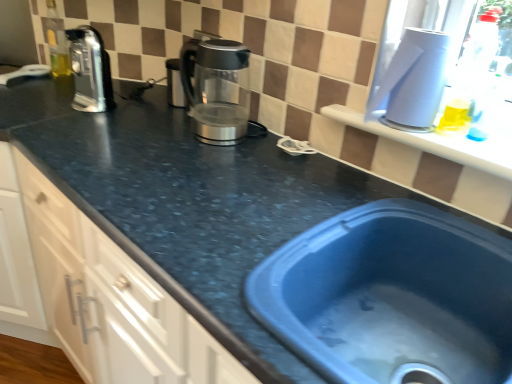
Question: From a real-world perspective, is satin silver kettle at center, which appears as the second appliance when viewed from the front, over matte black countertop at left?

Choices:
 (A) yes
 (B) no

Answer: (A)

Question: Can you confirm if satin silver kettle at center, the 2th appliance viewed from the right, is thinner than matte black countertop at left?

Choices:
 (A) yes
 (B) no

Answer: (A)

Question: From the image's perspective, is satin silver kettle at center, the 2th appliance viewed from the right, on matte black countertop at left?

Choices:
 (A) yes
 (B) no

Answer: (A)

Question: Can you confirm if satin silver kettle at center, placed as the 1th appliance when sorted from back to front, is wider than matte black countertop at left?

Choices:
 (A) no
 (B) yes

Answer: (A)

Question: Is satin silver kettle at center, which appears as the second appliance when viewed from the front, taller than matte black countertop at left?

Choices:
 (A) yes
 (B) no

Answer: (B)

Question: Considering the positions of satin silver coffee pot at upper left and matte black countertop at left in the image, is satin silver coffee pot at upper left wider or thinner than matte black countertop at left?

Choices:
 (A) wide
 (B) thin

Answer: (B)

Question: From a real-world perspective, is satin silver coffee pot at upper left physically located above or below matte black countertop at left?

Choices:
 (A) below
 (B) above

Answer: (B)

Question: Looking at the image, does satin silver coffee pot at upper left seem bigger or smaller compared to matte black countertop at left?

Choices:
 (A) small
 (B) big

Answer: (A)

Question: Is point (78, 82) closer or farther from the camera than point (90, 337)?

Choices:
 (A) farther
 (B) closer

Answer: (A)

Question: From their relative heights in the image, would you say satin silver kettle at center, the 2th appliance viewed from the right, is taller or shorter than blue plastic sink at lower right?

Choices:
 (A) tall
 (B) short

Answer: (B)

Question: In terms of width, does satin silver kettle at center, the 2th appliance viewed from the right, look wider or thinner when compared to blue plastic sink at lower right?

Choices:
 (A) thin
 (B) wide

Answer: (A)

Question: Looking at the image, does satin silver kettle at center, which appears as the second appliance when viewed from the front, seem bigger or smaller compared to blue plastic sink at lower right?

Choices:
 (A) small
 (B) big

Answer: (A)

Question: From a real-world perspective, is satin silver kettle at center, the 2th appliance viewed from the right, above or below blue plastic sink at lower right?

Choices:
 (A) above
 (B) below

Answer: (A)

Question: From their relative heights in the image, would you say white plastic container at upper right, which ranks as the first appliance in front-to-back order, is taller or shorter than sleek metallic kettle at center?

Choices:
 (A) short
 (B) tall

Answer: (A)

Question: Considering the positions of white plastic container at upper right, placed as the 1th appliance when sorted from right to left, and sleek metallic kettle at center in the image, is white plastic container at upper right, placed as the 1th appliance when sorted from right to left, wider or thinner than sleek metallic kettle at center?

Choices:
 (A) wide
 (B) thin

Answer: (B)